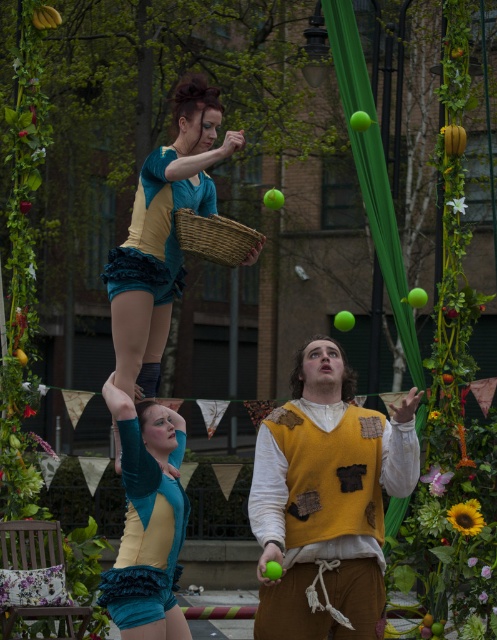
The height and width of the screenshot is (640, 497). Identify the location of matte yellow vest at center. (327, 500).

Can you confirm if matte yellow vest at center is positioned to the left of teal ruffled shorts at upper center?

Incorrect, matte yellow vest at center is not on the left side of teal ruffled shorts at upper center.

You are a GUI agent. You are given a task and a screenshot of the screen. Output one action in this format:
    pyautogui.click(x=<x>, y=<y>)
    Task: Click on the matte yellow vest at center
    
    Given the screenshot: What is the action you would take?
    pyautogui.click(x=327, y=500)

Is teal fabric shorts at upper center in front of teal velvet shorts at lower left?

No.

Between point (195, 166) and point (149, 516), which one is positioned behind?

Point (195, 166)

This screenshot has height=640, width=497. In order to click on teal fabric shorts at upper center in this screenshot , I will do `click(163, 236)`.

Does teal velvet shorts at lower left appear on the right side of woven brown basket at center?

Incorrect, teal velvet shorts at lower left is not on the right side of woven brown basket at center.

In the scene shown: Is teal velvet shorts at lower left thinner than woven brown basket at center?

No.

Locate an element on the screen. teal velvet shorts at lower left is located at coordinates (143, 536).